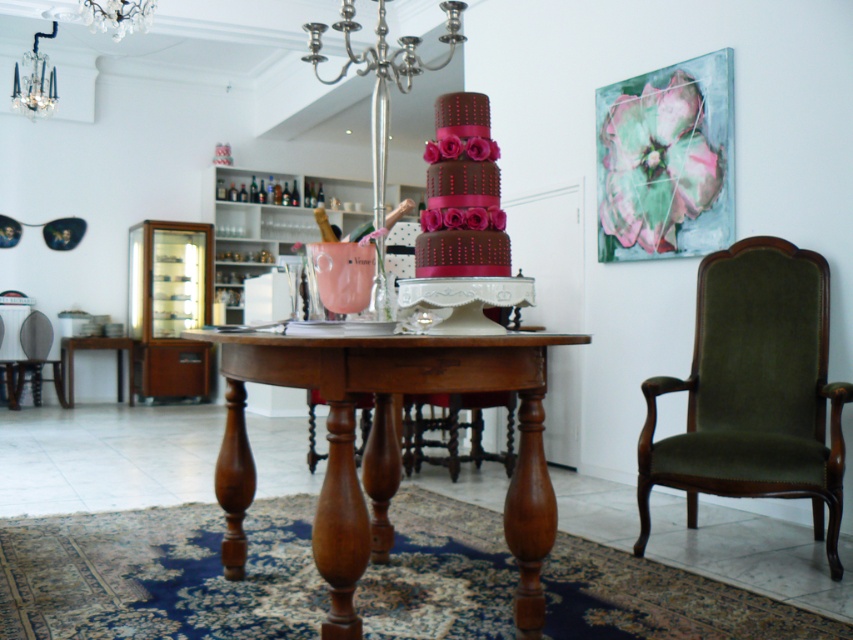
Between velvet green armchair at left and crystal glass chandelier at upper center, which one appears on the right side from the viewer's perspective?

Positioned to the right is crystal glass chandelier at upper center.

Is velvet green armchair at left above crystal glass chandelier at upper center?

Incorrect, velvet green armchair at left is not positioned above crystal glass chandelier at upper center.

Between point (41, 355) and point (109, 4), which one is positioned in front?

Positioned in front is point (109, 4).

Identify the location of velvet green armchair at left. The image size is (853, 640). (33, 360).

Who is positioned more to the right, velvet green armchair at left or silver metallic chandelier at upper left?

silver metallic chandelier at upper left

Does velvet green armchair at left have a larger size compared to silver metallic chandelier at upper left?

No, velvet green armchair at left is not bigger than silver metallic chandelier at upper left.

Where is `velvet green armchair at left`? velvet green armchair at left is located at coordinates (33, 360).

Where is `velvet green armchair at left`? velvet green armchair at left is located at coordinates (33, 360).

The height and width of the screenshot is (640, 853). I want to click on velvet green armchair at left, so click(33, 360).

Is velvet green armchair at left to the right of wooden table at lower left from the viewer's perspective?

Incorrect, velvet green armchair at left is not on the right side of wooden table at lower left.

The width and height of the screenshot is (853, 640). Find the location of `velvet green armchair at left`. velvet green armchair at left is located at coordinates (33, 360).